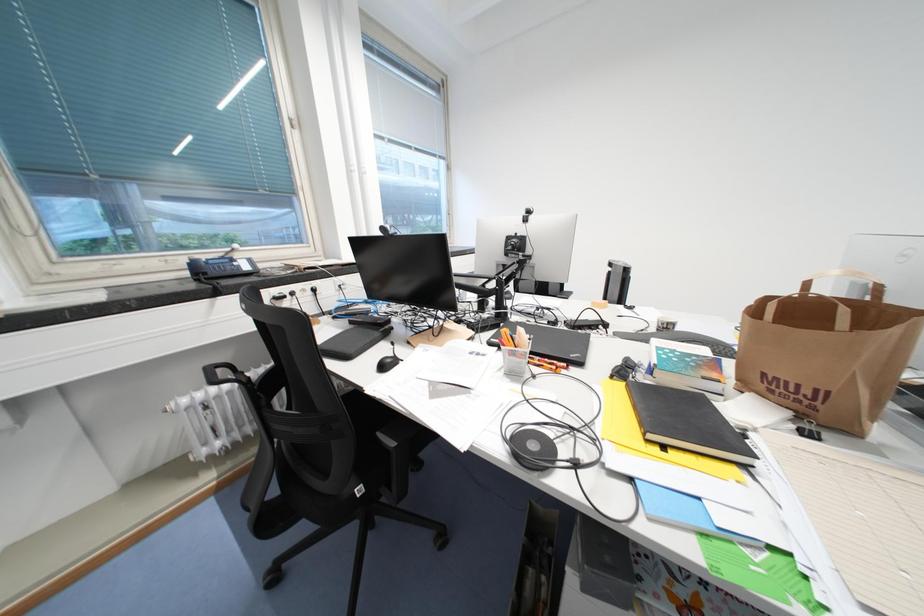
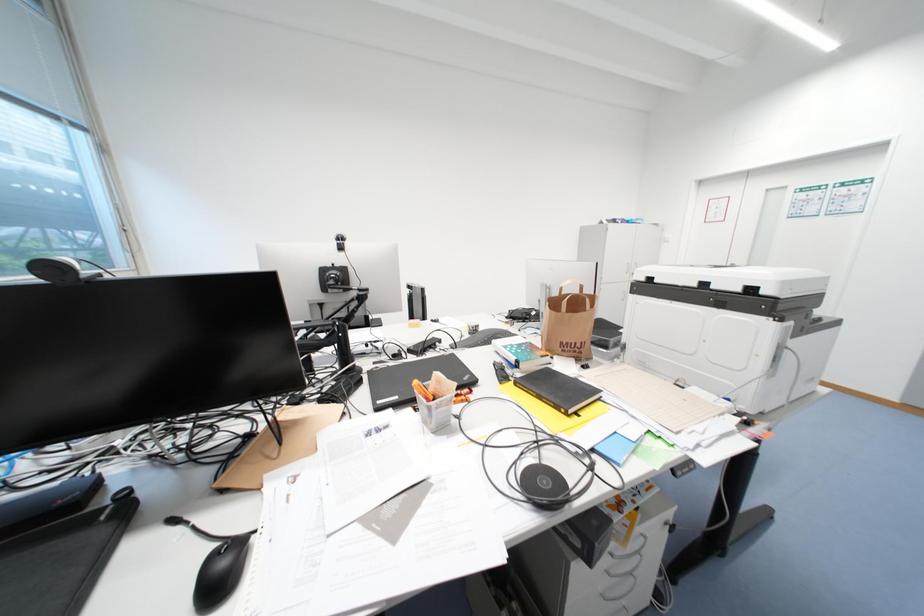
Question: Based on the continuous images, in which direction is the camera rotating? Reply with the corresponding letter.

Choices:
 (A) Left
 (B) Right
 (C) Up
 (D) Down

Answer: (B)